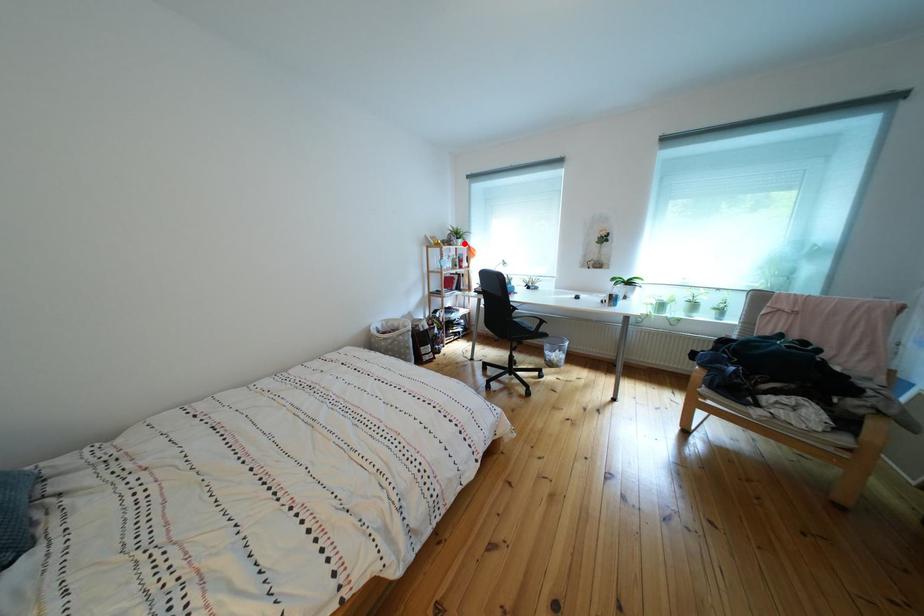
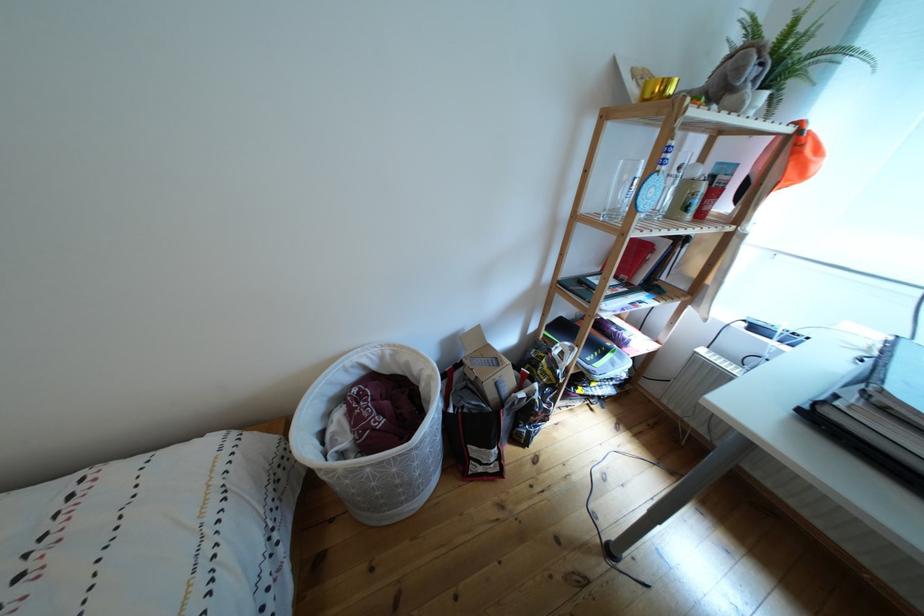
Question: I am providing you with two images of the same scene from different viewpoints. A red point is marked on the first image. Can you still see the location of the red point in image 2?

Choices:
 (A) Yes
 (B) No

Answer: (A)